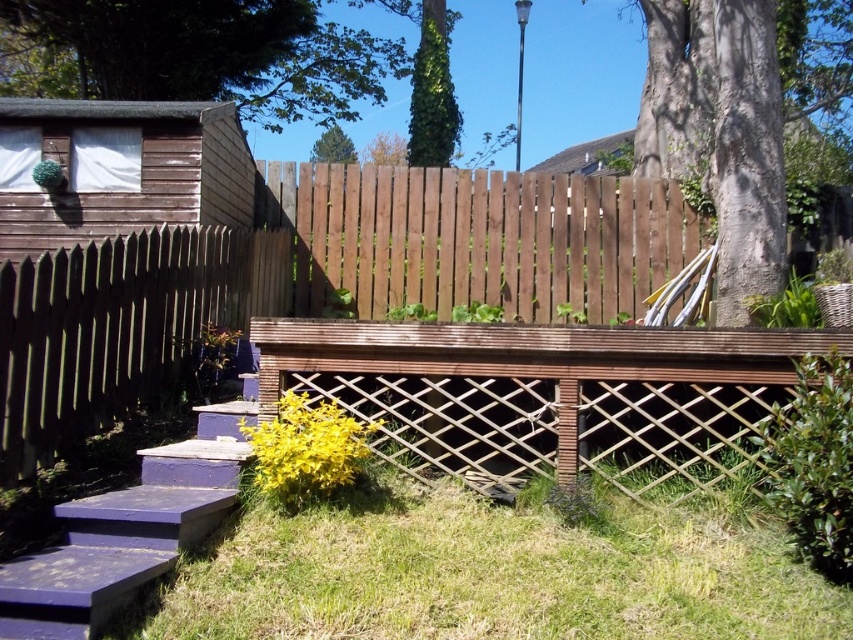
Between brown wooden deck at center and purple painted wood stairs at lower left, which one is positioned lower?

purple painted wood stairs at lower left is lower down.

Where is `brown wooden deck at center`? Image resolution: width=853 pixels, height=640 pixels. brown wooden deck at center is located at coordinates (544, 396).

Locate an element on the screen. brown wooden deck at center is located at coordinates (544, 396).

Is point (474, 496) positioned before point (177, 227)?

Yes, point (474, 496) is in front of point (177, 227).

Does green grass at lower center appear over brown wooden fence at left?

Incorrect, green grass at lower center is not positioned above brown wooden fence at left.

The height and width of the screenshot is (640, 853). In order to click on green grass at lower center in this screenshot , I will do `click(491, 572)`.

Where is `green grass at lower center`? Image resolution: width=853 pixels, height=640 pixels. green grass at lower center is located at coordinates (491, 572).

Is point (656, 442) positioned after point (53, 268)?

Yes, it is behind point (53, 268).

Describe the element at coordinates (544, 396) in the screenshot. The width and height of the screenshot is (853, 640). I see `brown wooden deck at center` at that location.

Who is more forward, (663, 464) or (80, 422)?

Point (80, 422) is in front.

At what (x,y) coordinates should I click in order to perform the action: click on brown wooden deck at center. Please return your answer as a coordinate pair (x, y). Looking at the image, I should click on (544, 396).